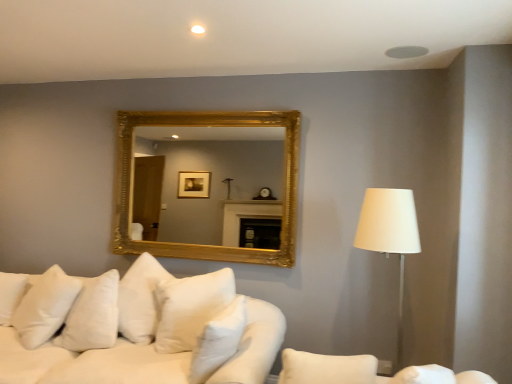
Question: Is the position of white soft pillow at lower left, acting as the second pillow starting from the front, more distant than that of white fabric lampshade at right?

Choices:
 (A) yes
 (B) no

Answer: (A)

Question: Is white soft pillow at lower left, the second pillow in the right-to-left sequence, located outside white fabric lampshade at right?

Choices:
 (A) no
 (B) yes

Answer: (B)

Question: Is white soft pillow at lower left, the second pillow in the right-to-left sequence, taller than white fabric lampshade at right?

Choices:
 (A) no
 (B) yes

Answer: (A)

Question: Could white fabric lampshade at right be considered to be inside white soft pillow at lower left, acting as the second pillow starting from the front?

Choices:
 (A) yes
 (B) no

Answer: (B)

Question: Does white soft pillow at lower left, the 1th pillow from the back, lie in front of white fabric lampshade at right?

Choices:
 (A) no
 (B) yes

Answer: (A)

Question: Is white soft pillow at lower left, the second pillow in the right-to-left sequence, turned away from white fabric lampshade at right?

Choices:
 (A) no
 (B) yes

Answer: (A)

Question: Is white fabric couch at lower right closer to the viewer compared to white soft cushions at lower left?

Choices:
 (A) yes
 (B) no

Answer: (A)

Question: From a real-world perspective, is white fabric couch at lower right under white soft cushions at lower left?

Choices:
 (A) yes
 (B) no

Answer: (B)

Question: From the image's perspective, does white fabric couch at lower right appear lower than white soft cushions at lower left?

Choices:
 (A) no
 (B) yes

Answer: (A)

Question: Does white fabric couch at lower right turn towards white soft cushions at lower left?

Choices:
 (A) yes
 (B) no

Answer: (A)

Question: Considering the relative positions of white fabric couch at lower right and white soft cushions at lower left in the image provided, is white fabric couch at lower right to the right of white soft cushions at lower left from the viewer's perspective?

Choices:
 (A) yes
 (B) no

Answer: (A)

Question: Is white fabric couch at lower right outside of white soft cushions at lower left?

Choices:
 (A) no
 (B) yes

Answer: (B)

Question: From the image's perspective, is gold/gilded mirror at upper center over white soft pillow at center, the second pillow from the back?

Choices:
 (A) no
 (B) yes

Answer: (B)